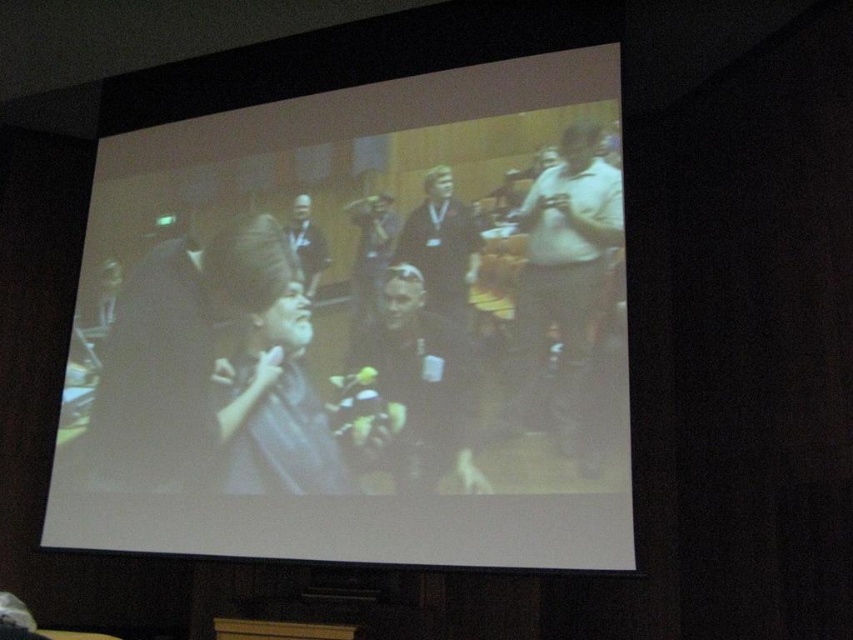
You are in a dark room where a presentation is being shown on a projection screen. You see two points on the screen labeled as point (334, 440) and point (550, 179). Which point is closer to the camera that is projecting the image?

Point (550, 179) is closer to the camera that is projecting the image because it is less further away than point (334, 440).

You are organizing a presentation and need to decide whether to place a matte black laptop at center on top of a white matte shirt at center. Based on their sizes, which one should be placed below the other to ensure stability?

The matte black laptop at center is larger than the white matte shirt at center, so placing the white matte shirt at center below the matte black laptop at center would provide better stability.

You are in a dark room preparing to give a presentation. You see a point at coordinates (352, 332) where you need to place your matte black laptop. Is the matte black laptop at center already placed correctly?

The matte black laptop at center is located at point (352, 332), so yes, it is already placed correctly at that coordinate.